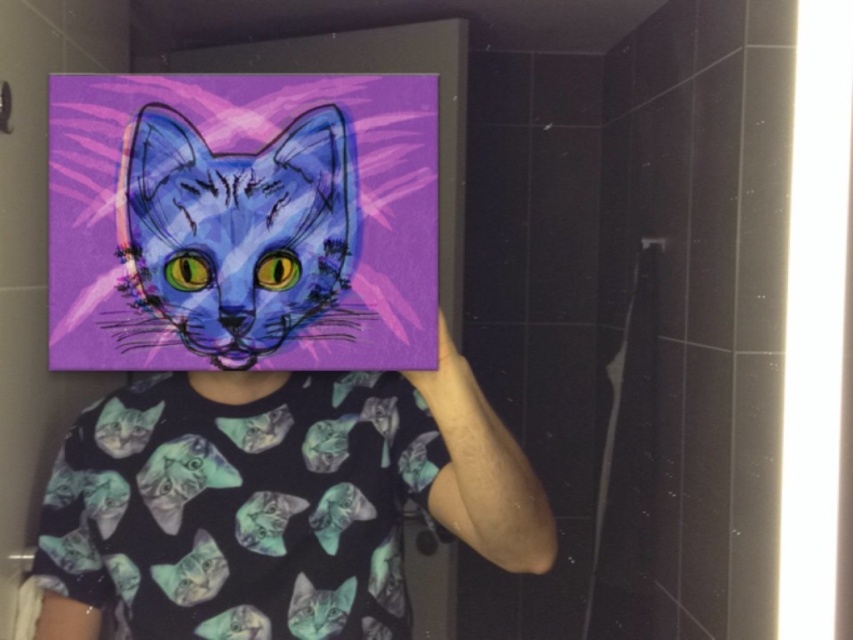
Question: Which of the following is the farthest from the observer?

Choices:
 (A) (224, 188)
 (B) (190, 268)

Answer: (B)

Question: Which object is farther from the camera taking this photo?

Choices:
 (A) matte purple painting at upper center
 (B) matte blue cat at upper left

Answer: (A)

Question: Does matte purple painting at upper center appear on the right side of matte blue cat at upper left?

Choices:
 (A) yes
 (B) no

Answer: (B)

Question: Can you confirm if matte purple painting at upper center is positioned above matte blue cat at upper left?

Choices:
 (A) yes
 (B) no

Answer: (B)

Question: Is matte purple painting at upper center to the right of matte blue cat at upper left from the viewer's perspective?

Choices:
 (A) no
 (B) yes

Answer: (A)